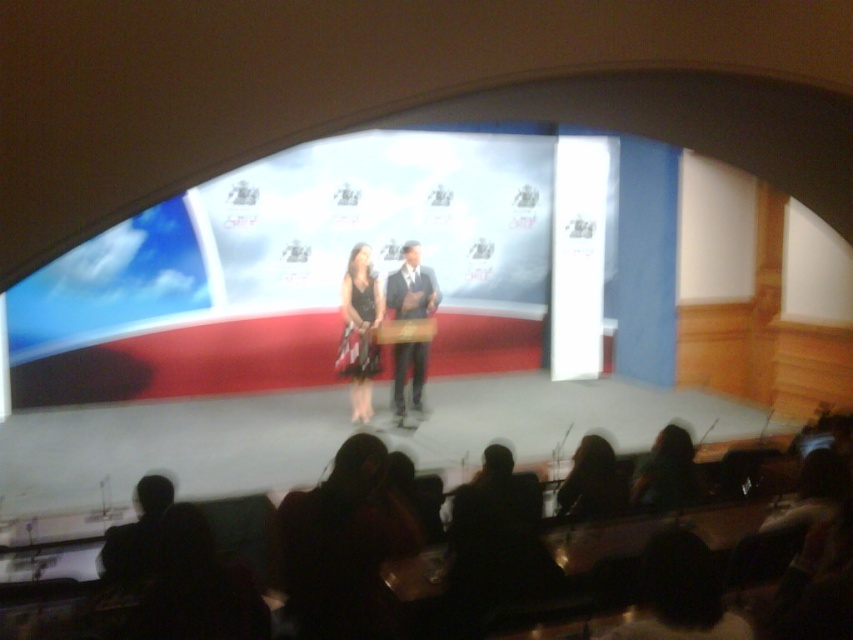
You are a photographer positioned at the back of the auditorium. You notice two elements in the scene that you want to capture in your photo. The silky brown hair at lower center and the green matte dress at lower right. Which of these two elements is positioned lower in the frame?

The silky brown hair at lower center is positioned below the green matte dress at lower right, so it is lower in the frame.

You are a photographer positioned at the back of the stage. You want to capture a photo where both the silky brown hair at lower center and the green matte dress at lower right are in focus. Given that your camera can only focus on objects within a 10 inch range, will you be able to achieve this?

The silky brown hair at lower center and the green matte dress at lower right are 8.93 inches apart. Since the distance between them is within the 10 inch range of your camera, you can capture both in focus.

You are an event planner setting up a camera to capture the dark suit at center on stage. The camera is placed at the point with coordinates point [410,285]. Will the camera be positioned directly at the dark suit at center?

Yes, the camera placed at point [410,285] will be positioned directly at the dark suit at center because the point marks the location of the dark suit at center.